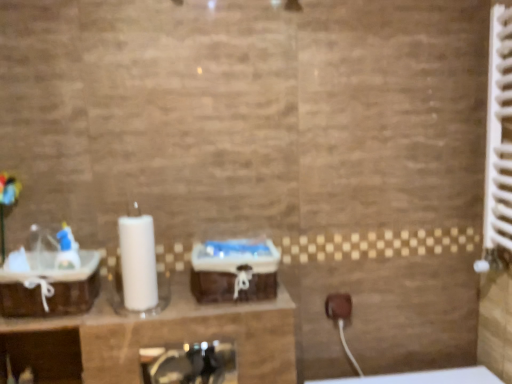
Question: From a real-world perspective, is white plastic radiator at right below brown woven basket at left?

Choices:
 (A) no
 (B) yes

Answer: (A)

Question: Does white plastic radiator at right turn towards brown woven basket at left?

Choices:
 (A) yes
 (B) no

Answer: (A)

Question: Would you say white plastic radiator at right is outside brown woven basket at left?

Choices:
 (A) yes
 (B) no

Answer: (A)

Question: Is white plastic radiator at right positioned in front of brown woven basket at left?

Choices:
 (A) no
 (B) yes

Answer: (B)

Question: Can you confirm if white plastic radiator at right is thinner than brown woven basket at left?

Choices:
 (A) yes
 (B) no

Answer: (A)

Question: From the image's perspective, is white plastic radiator at right under brown woven basket at left?

Choices:
 (A) no
 (B) yes

Answer: (A)

Question: Would you consider brown woven basket at left to be distant from white plastic radiator at right?

Choices:
 (A) no
 (B) yes

Answer: (B)

Question: Is brown woven basket at left further to camera compared to white plastic radiator at right?

Choices:
 (A) yes
 (B) no

Answer: (A)

Question: Does brown woven basket at left turn towards white plastic radiator at right?

Choices:
 (A) yes
 (B) no

Answer: (B)

Question: Is brown woven basket at left oriented away from white plastic radiator at right?

Choices:
 (A) no
 (B) yes

Answer: (A)

Question: Does brown woven basket at left lie in front of white plastic radiator at right?

Choices:
 (A) yes
 (B) no

Answer: (B)

Question: From the image's perspective, does brown woven basket at left appear higher than white plastic radiator at right?

Choices:
 (A) yes
 (B) no

Answer: (B)

Question: Considering the positions of point (497, 26) and point (22, 276), is point (497, 26) closer or farther from the camera than point (22, 276)?

Choices:
 (A) farther
 (B) closer

Answer: (A)